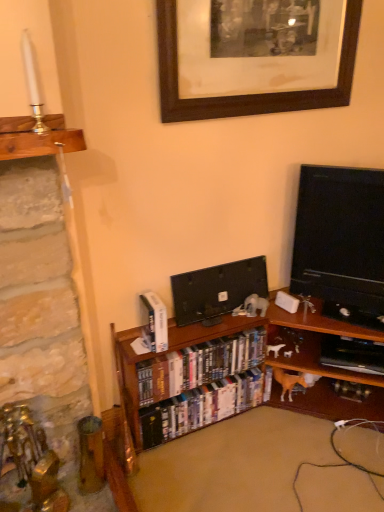
I want to click on free space in front of hardcover books at center, acting as the 1th book starting from the bottom, so click(x=204, y=470).